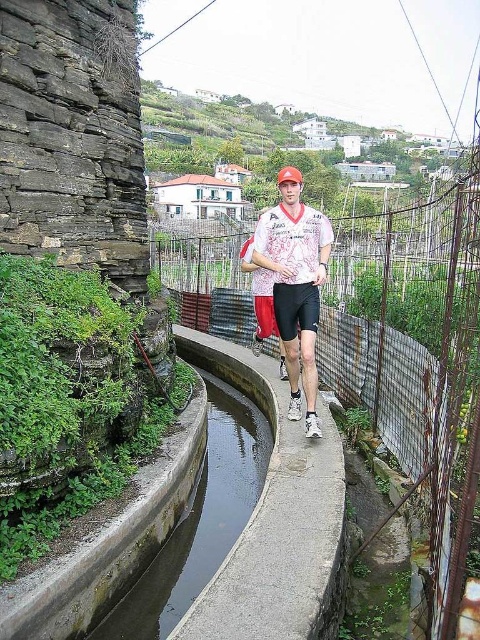
Question: Is green concrete canal at center thinner than white printed shirt at center?

Choices:
 (A) no
 (B) yes

Answer: (A)

Question: Which point appears farthest from the camera in this image?

Choices:
 (A) (300, 364)
 (B) (140, 621)

Answer: (A)

Question: Is green concrete canal at center to the right of white printed shirt at center from the viewer's perspective?

Choices:
 (A) yes
 (B) no

Answer: (B)

Question: Does green concrete canal at center appear under white printed shirt at center?

Choices:
 (A) yes
 (B) no

Answer: (A)

Question: Which of the following is the closest to the observer?

Choices:
 (A) (317, 433)
 (B) (210, 502)

Answer: (A)